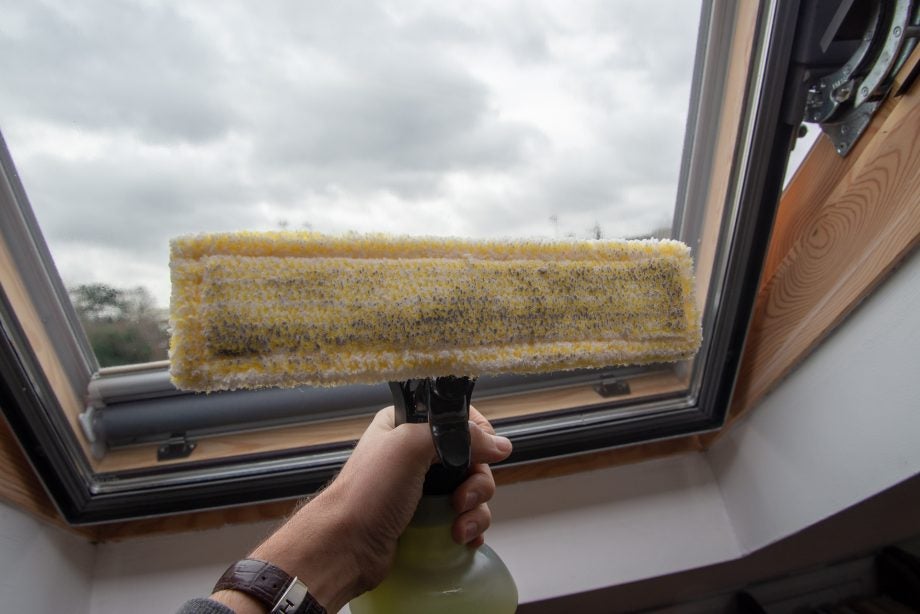
Find the location of `windows`. windows is located at coordinates (456, 301), (291, 123).